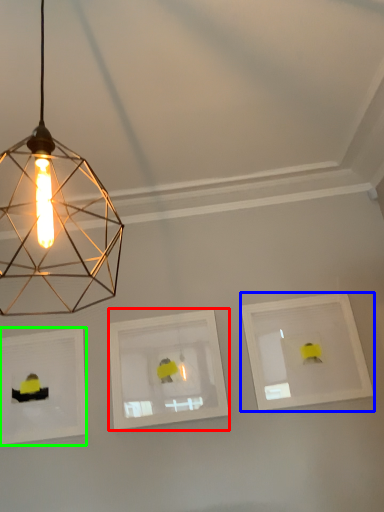
Question: Based on their relative distances, which object is farther from picture frame (highlighted by a red box)? Choose from picture frame (highlighted by a blue box) and picture frame (highlighted by a green box).

Choices:
 (A) picture frame
 (B) picture frame

Answer: (A)